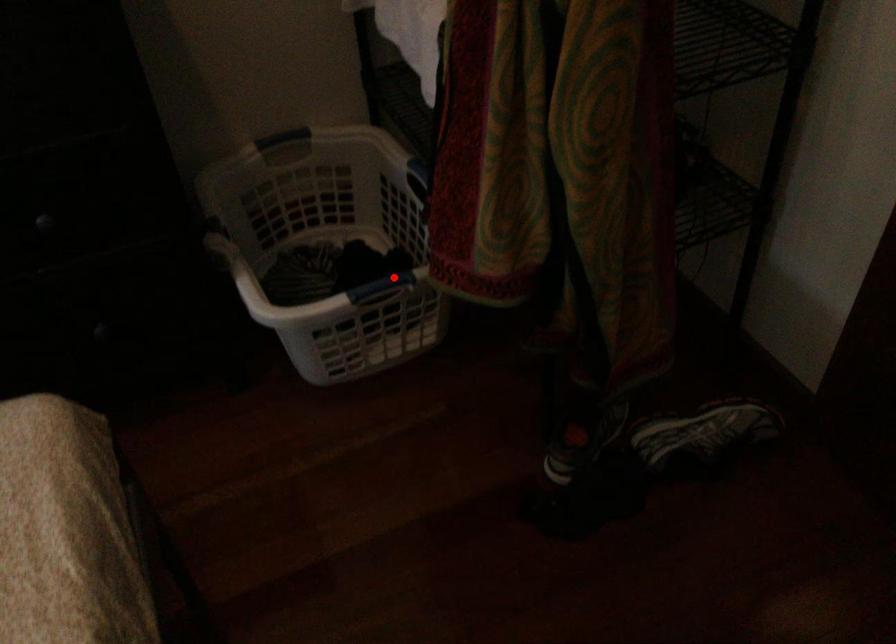
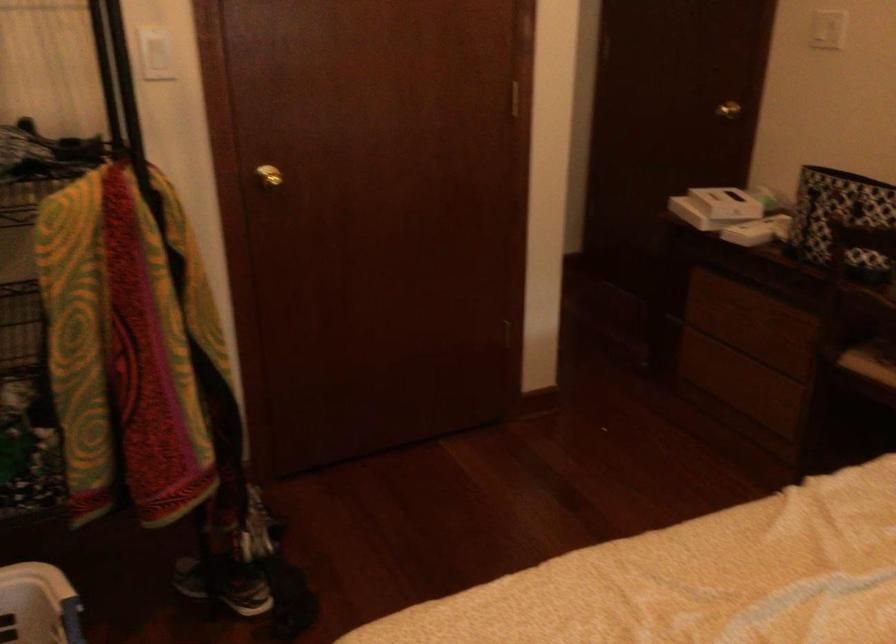
In the second image, find the point that corresponds to the highlighted location in the first image.

(63, 616)